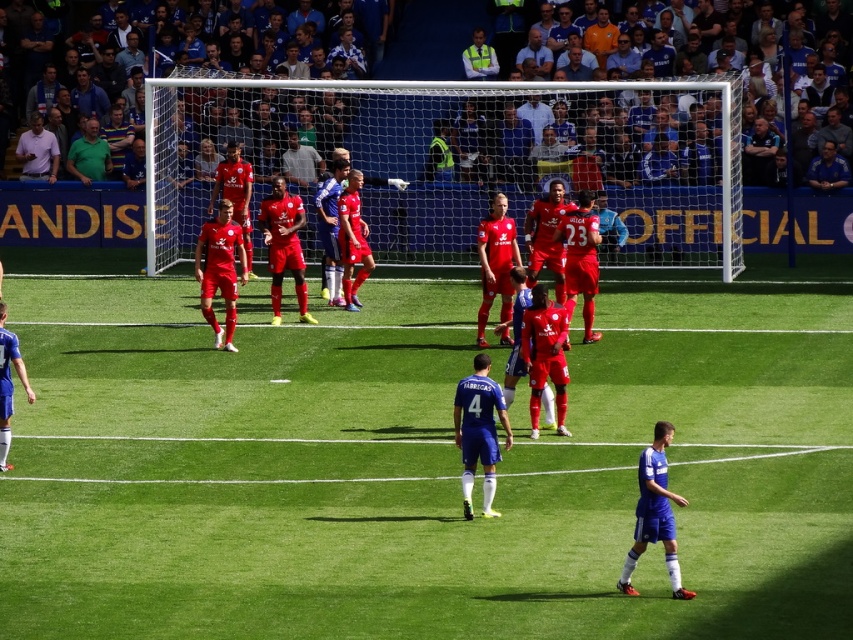
Can you confirm if pink shirt at upper left is positioned to the left of high visibility vest at upper center?

Yes, pink shirt at upper left is to the left of high visibility vest at upper center.

Between pink shirt at upper left and high visibility vest at upper center, which one is positioned higher?

Positioned higher is high visibility vest at upper center.

Who is more distant from viewer, (24, 134) or (466, 65)?

The point (466, 65) is behind.

Where is `pink shirt at upper left`? Image resolution: width=853 pixels, height=640 pixels. pink shirt at upper left is located at coordinates (38, 150).

Is point (596, 124) in front of point (479, 68)?

Yes, point (596, 124) is in front of point (479, 68).

Does white mesh net at center appear on the right side of high visibility vest at upper center?

Incorrect, white mesh net at center is not on the right side of high visibility vest at upper center.

Describe the element at coordinates (456, 160) in the screenshot. The width and height of the screenshot is (853, 640). I see `white mesh net at center` at that location.

You are a GUI agent. You are given a task and a screenshot of the screen. Output one action in this format:
    pyautogui.click(x=<x>, y=<y>)
    Task: Click on the white mesh net at center
    This screenshot has width=853, height=640.
    Given the screenshot: What is the action you would take?
    pyautogui.click(x=456, y=160)

Does blue fabric jersey at lower right appear on the left side of green matte shirt at upper left?

In fact, blue fabric jersey at lower right is to the right of green matte shirt at upper left.

How far apart are blue fabric jersey at lower right and green matte shirt at upper left?

A distance of 20.38 meters exists between blue fabric jersey at lower right and green matte shirt at upper left.

Which is in front, point (664, 436) or point (106, 164)?

Point (664, 436)

Locate an element on the screen. This screenshot has height=640, width=853. blue fabric jersey at lower right is located at coordinates (654, 513).